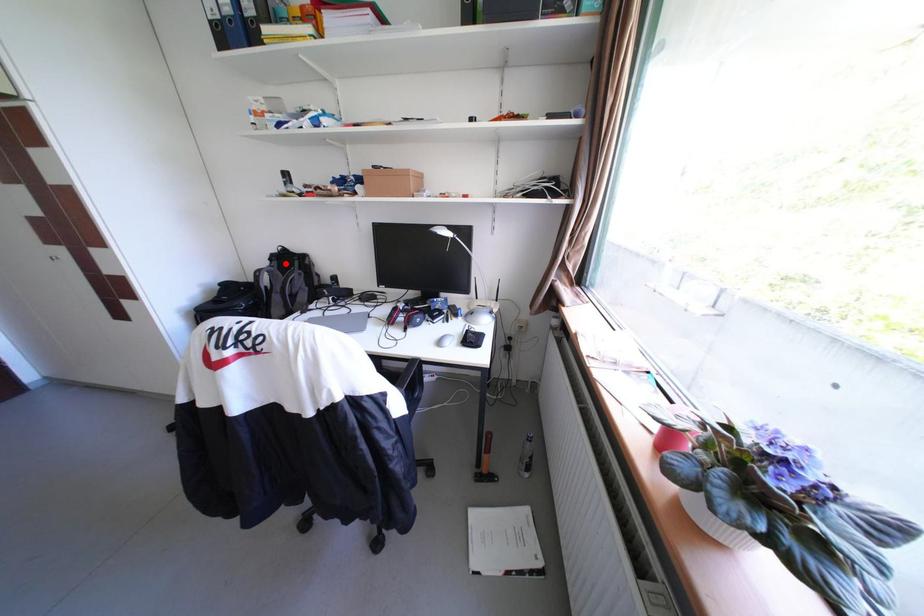
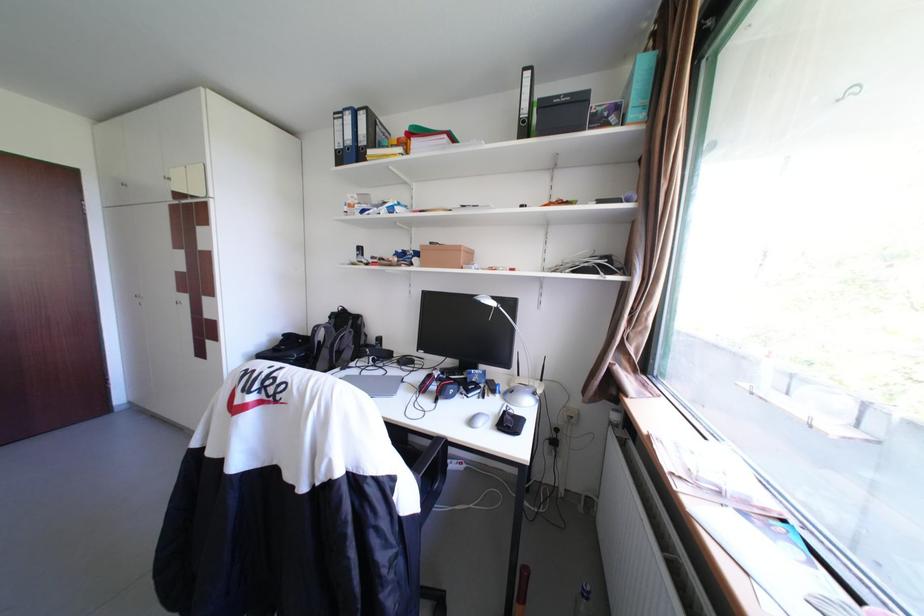
Question: I am providing you with two images of the same scene from different viewpoints. A red point is shown in image1. For the corresponding object point in image2, is it positioned nearer or farther from the camera?

Choices:
 (A) Nearer
 (B) Farther

Answer: (B)